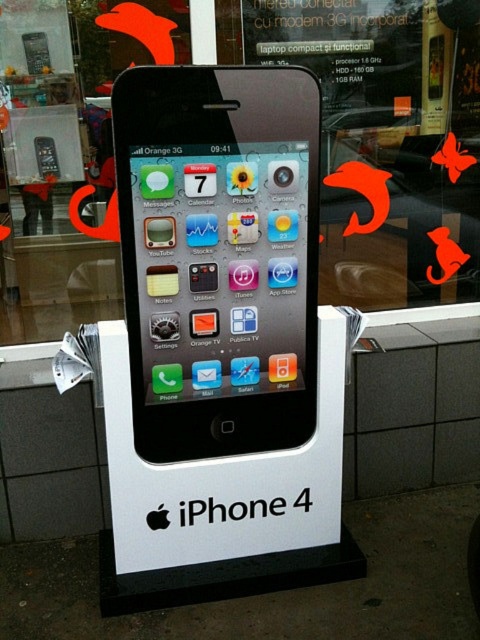
Question: Does matte black iphone 4 at center come behind matte black phone at center?

Choices:
 (A) yes
 (B) no

Answer: (B)

Question: In this image, where is matte black iphone 4 at center located relative to matte black phone at center?

Choices:
 (A) above
 (B) below

Answer: (B)

Question: Which object appears closest to the camera in this image?

Choices:
 (A) matte black iphone 4 at center
 (B) matte black phone at center

Answer: (A)

Question: Which object appears farthest from the camera in this image?

Choices:
 (A) matte black iphone 4 at center
 (B) matte black phone at center

Answer: (B)

Question: Which object appears farthest from the camera in this image?

Choices:
 (A) matte black phone at center
 (B) matte black iphone 4 at center

Answer: (A)

Question: Is the position of matte black iphone 4 at center less distant than that of matte black phone at center?

Choices:
 (A) no
 (B) yes

Answer: (B)